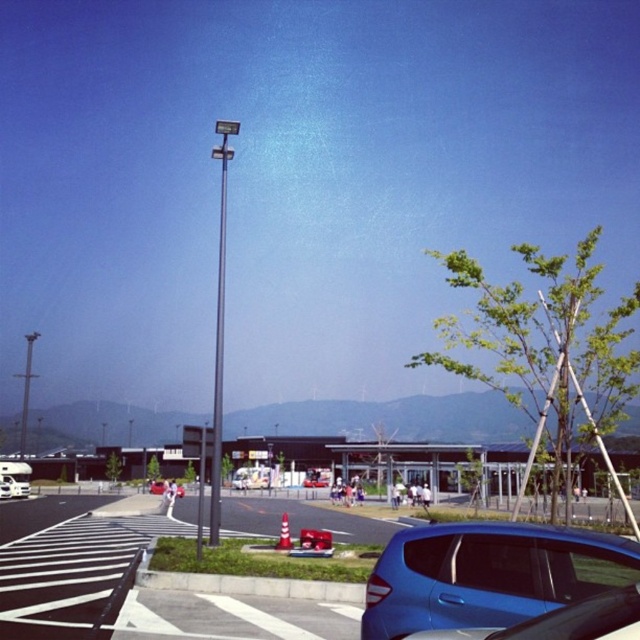
Is glossy blue hatchback at lower right closer to the viewer compared to metallic silver van at center?

That is True.

Who is more forward, [593,573] or [307,486]?

Positioned in front is point [593,573].

Locate an element on the screen. glossy blue hatchback at lower right is located at coordinates (486, 573).

Locate an element on the screen. The height and width of the screenshot is (640, 640). glossy blue hatchback at lower right is located at coordinates (486, 573).

Is metallic silver car at center smaller than metallic silver van at center?

Indeed, metallic silver car at center has a smaller size compared to metallic silver van at center.

Locate an element on the screen. This screenshot has width=640, height=640. metallic silver car at center is located at coordinates (250, 477).

Between point (264, 484) and point (310, 468), which one is positioned behind?

The point (310, 468) is more distant.

You are a GUI agent. You are given a task and a screenshot of the screen. Output one action in this format:
    pyautogui.click(x=<x>, y=<y>)
    Task: Click on the metallic silver car at center
    This screenshot has height=640, width=640.
    Given the screenshot: What is the action you would take?
    pyautogui.click(x=250, y=477)

Based on the photo, is metallic silver car at center smaller than white glossy camper van at lower left?

Correct, metallic silver car at center occupies less space than white glossy camper van at lower left.

The height and width of the screenshot is (640, 640). In order to click on metallic silver car at center in this screenshot , I will do pyautogui.click(x=250, y=477).